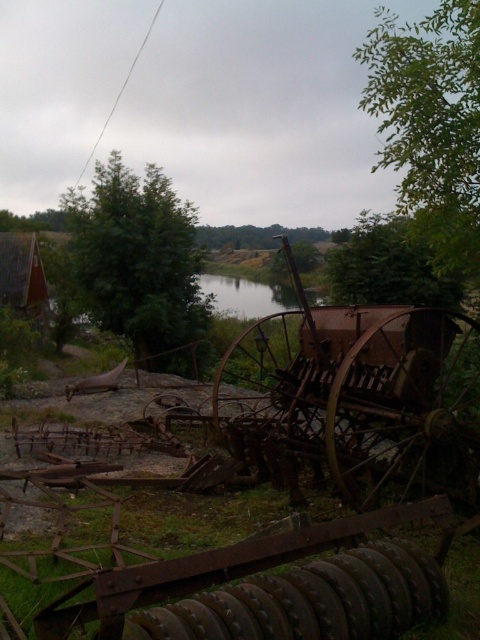
Question: Is the position of green leafy tree at upper left less distant than that of green matte tree at upper right?

Choices:
 (A) no
 (B) yes

Answer: (A)

Question: Estimate the real-world distances between objects in this image. Which object is closer to the green leafy tree at upper right?

Choices:
 (A) green leafy tree at upper left
 (B) green matte tree at upper right

Answer: (B)

Question: Which of the following is the farthest from the observer?

Choices:
 (A) green matte tree at upper right
 (B) green leafy tree at upper right

Answer: (A)

Question: Is green leafy tree at upper right to the right of green matte tree at upper right from the viewer's perspective?

Choices:
 (A) yes
 (B) no

Answer: (A)

Question: Which object is farther from the camera taking this photo?

Choices:
 (A) green leafy tree at upper left
 (B) green matte tree at upper right
 (C) green leafy tree at upper right

Answer: (A)

Question: Can you confirm if green leafy tree at upper right is bigger than green matte tree at upper right?

Choices:
 (A) yes
 (B) no

Answer: (A)